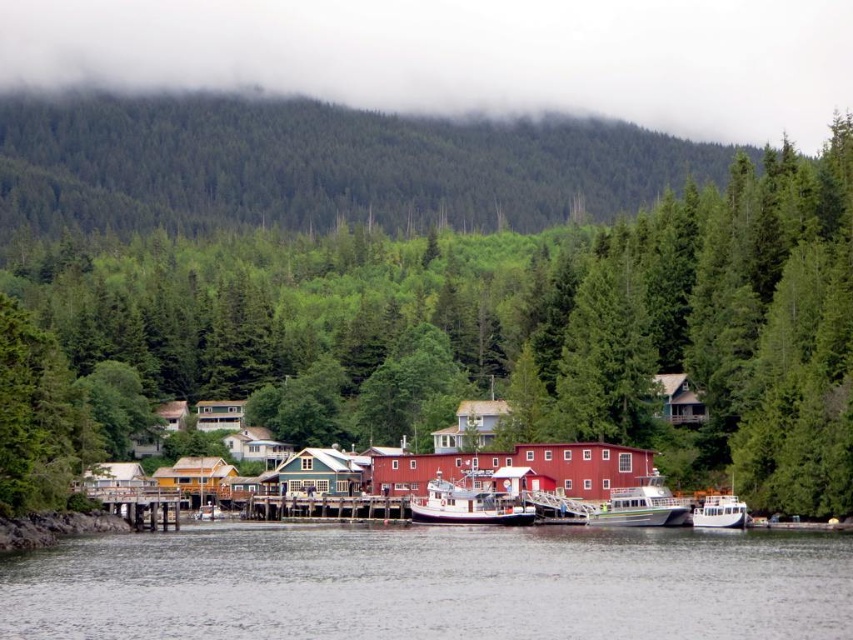
Question: Can you confirm if clear water at lower center is wider than white glossy boat at lower center?

Choices:
 (A) yes
 (B) no

Answer: (A)

Question: Which point is farther from the camera taking this photo?

Choices:
 (A) (724, 500)
 (B) (291, 528)

Answer: (B)

Question: Which of these objects is positioned closest to the white glossy boat at lower right?

Choices:
 (A) white wooden boat at center
 (B) green textured tree at center
 (C) white glossy boat at lower center

Answer: (C)

Question: Does green textured tree at center appear over clear water at lower center?

Choices:
 (A) no
 (B) yes

Answer: (B)

Question: Which object is positioned farthest from the white wooden boat at center?

Choices:
 (A) white glossy boat at lower right
 (B) clear water at lower center

Answer: (B)

Question: From the image, what is the correct spatial relationship of clear water at lower center in relation to white glossy boat at lower right?

Choices:
 (A) below
 (B) above

Answer: (A)